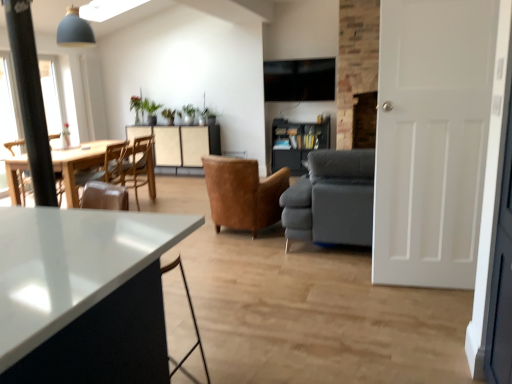
Question: From the image's perspective, is wooden chair at left, which ranks as the second chair in right-to-left order, on top of leather armchair at center, the third chair in the left-to-right sequence?

Choices:
 (A) no
 (B) yes

Answer: (B)

Question: Is wooden chair at left, which ranks as the second chair in right-to-left order, oriented away from leather armchair at center, the third chair in the left-to-right sequence?

Choices:
 (A) yes
 (B) no

Answer: (B)

Question: Can you confirm if wooden chair at left, which ranks as the second chair in right-to-left order, is positioned to the left of leather armchair at center, acting as the 1th chair starting from the right?

Choices:
 (A) no
 (B) yes

Answer: (B)

Question: Is wooden chair at left, which is the second chair in left-to-right order, positioned before leather armchair at center, acting as the 1th chair starting from the right?

Choices:
 (A) yes
 (B) no

Answer: (B)

Question: Is leather armchair at center, acting as the 1th chair starting from the right, completely or partially inside wooden chair at left, which ranks as the second chair in right-to-left order?

Choices:
 (A) no
 (B) yes

Answer: (A)

Question: Is point (340, 226) positioned closer to the camera than point (118, 147)?

Choices:
 (A) farther
 (B) closer

Answer: (B)

Question: From a real-world perspective, is dark gray fabric couch at center physically located above or below wooden chair at left, which is the second chair in left-to-right order?

Choices:
 (A) below
 (B) above

Answer: (A)

Question: Based on their sizes in the image, would you say dark gray fabric couch at center is bigger or smaller than wooden chair at left, which ranks as the second chair in right-to-left order?

Choices:
 (A) small
 (B) big

Answer: (B)

Question: Considering their positions, is dark gray fabric couch at center located in front of or behind wooden chair at left, which ranks as the second chair in right-to-left order?

Choices:
 (A) front
 (B) behind

Answer: (A)

Question: Looking at the image, does leather armchair at center, acting as the 1th chair starting from the right, seem bigger or smaller compared to green matte plant at upper center?

Choices:
 (A) small
 (B) big

Answer: (B)

Question: From a real-world perspective, is leather armchair at center, the third chair in the left-to-right sequence, physically located above or below green matte plant at upper center?

Choices:
 (A) above
 (B) below

Answer: (B)

Question: Considering the relative positions of leather armchair at center, the third chair in the left-to-right sequence, and green matte plant at upper center in the image provided, is leather armchair at center, the third chair in the left-to-right sequence, to the left or to the right of green matte plant at upper center?

Choices:
 (A) right
 (B) left

Answer: (A)

Question: Is leather armchair at center, the third chair in the left-to-right sequence, spatially inside green matte plant at upper center, or outside of it?

Choices:
 (A) outside
 (B) inside

Answer: (A)

Question: From the image's perspective, is beige textured cabinet at center positioned above or below white matte door at right?

Choices:
 (A) below
 (B) above

Answer: (B)

Question: Considering the positions of beige textured cabinet at center and white matte door at right in the image, is beige textured cabinet at center bigger or smaller than white matte door at right?

Choices:
 (A) small
 (B) big

Answer: (B)